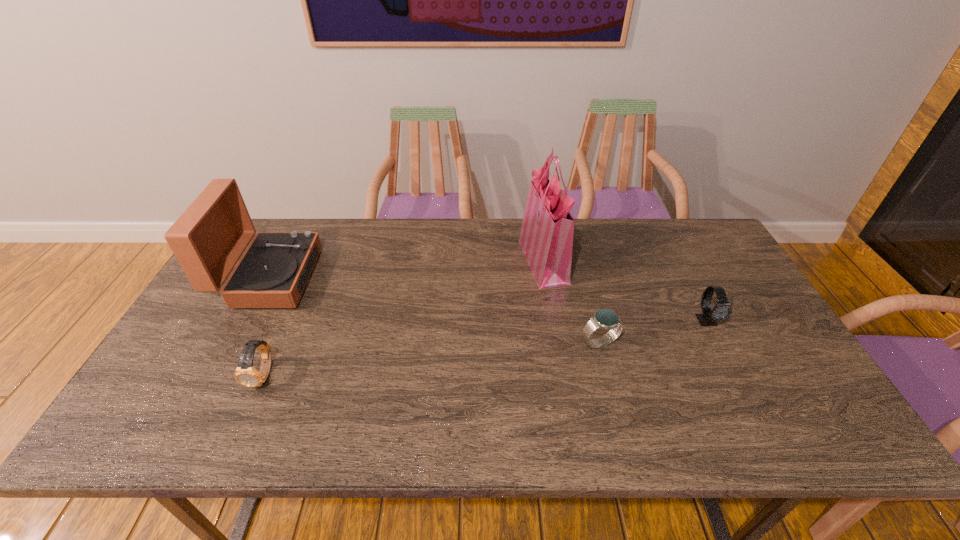
What are the coordinates of `vacant space in between the leftmost watch and the phonograph record` in the screenshot? It's located at (267, 326).

The width and height of the screenshot is (960, 540). I want to click on vacant point located between the rightmost object and the shopping bag, so click(x=625, y=291).

Where is `free spot between the rightmost watch and the nearest watch`? The image size is (960, 540). free spot between the rightmost watch and the nearest watch is located at coordinates (486, 348).

You are a GUI agent. You are given a task and a screenshot of the screen. Output one action in this format:
    pyautogui.click(x=<x>, y=<y>)
    Task: Click on the free space between the second farthest watch and the farthest watch
    
    Given the screenshot: What is the action you would take?
    pyautogui.click(x=654, y=332)

Find the location of `the fourth closest object to the tallest object`. the fourth closest object to the tallest object is located at coordinates (245, 374).

Locate which object is the second closest to the leftmost watch. Please provide its 2D coordinates. Your answer should be formatted as a tuple, i.e. [(x, y)], where the tuple contains the x and y coordinates of a point satisfying the conditions above.

[(546, 237)]

Locate which watch ranks in proximity to the nearest watch. Please provide its 2D coordinates. Your answer should be formatted as a tuple, i.e. [(x, y)], where the tuple contains the x and y coordinates of a point satisfying the conditions above.

[(606, 319)]

Where is `the third closest watch to the fourth shortest object`? This screenshot has width=960, height=540. the third closest watch to the fourth shortest object is located at coordinates (722, 310).

This screenshot has height=540, width=960. What are the coordinates of `free space that satisfies the following two spatial constraints: 1. on the face of the second nearest watch; 2. on the left side of the fourth shortest object` in the screenshot? It's located at (235, 343).

At what (x,y) coordinates should I click in order to perform the action: click on free space that satisfies the following two spatial constraints: 1. on the face of the fourth farthest object; 2. on the right side of the fourth shortest object. Please return your answer as a coordinate pair (x, y). The width and height of the screenshot is (960, 540). Looking at the image, I should click on (235, 343).